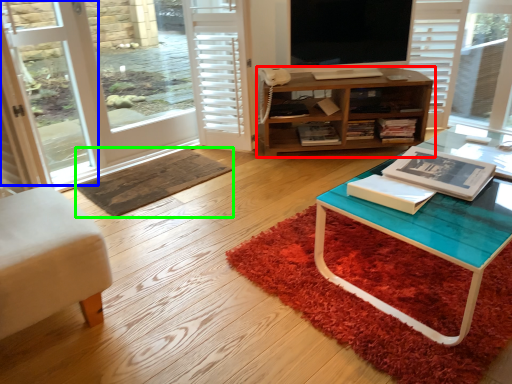
Question: Which object is positioned farthest from cabinetry (highlighted by a red box)? Select from screen door (highlighted by a blue box) and doormat (highlighted by a green box).

Choices:
 (A) screen door
 (B) doormat

Answer: (A)